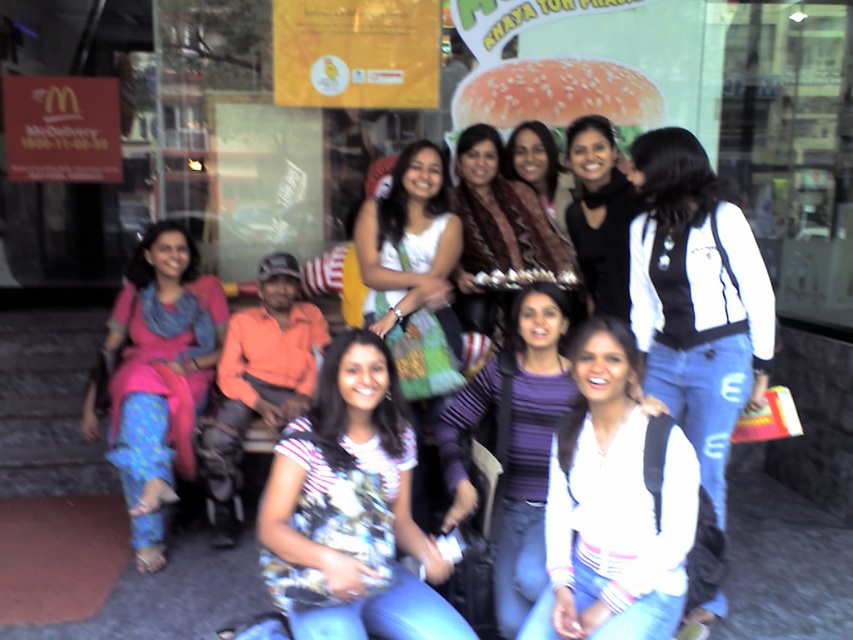
Is matte pink dress at left shorter than black matte jacket at upper center?

No.

You are a GUI agent. You are given a task and a screenshot of the screen. Output one action in this format:
    pyautogui.click(x=<x>, y=<y>)
    Task: Click on the matte pink dress at left
    The image size is (853, 640).
    Given the screenshot: What is the action you would take?
    pyautogui.click(x=160, y=376)

What do you see at coordinates (599, 214) in the screenshot? The height and width of the screenshot is (640, 853). I see `black matte jacket at upper center` at bounding box center [599, 214].

Does point (618, 212) come farther from viewer compared to point (544, 125)?

No, (618, 212) is closer to viewer.

Identify the location of black matte jacket at upper center. (599, 214).

Can you confirm if matte pink dress at left is shorter than striped shirt at center?

No, matte pink dress at left is not shorter than striped shirt at center.

Between matte pink dress at left and striped shirt at center, which one has less height?

striped shirt at center is shorter.

The height and width of the screenshot is (640, 853). Describe the element at coordinates (160, 376) in the screenshot. I see `matte pink dress at left` at that location.

What are the coordinates of `matte pink dress at left` in the screenshot? It's located at (160, 376).